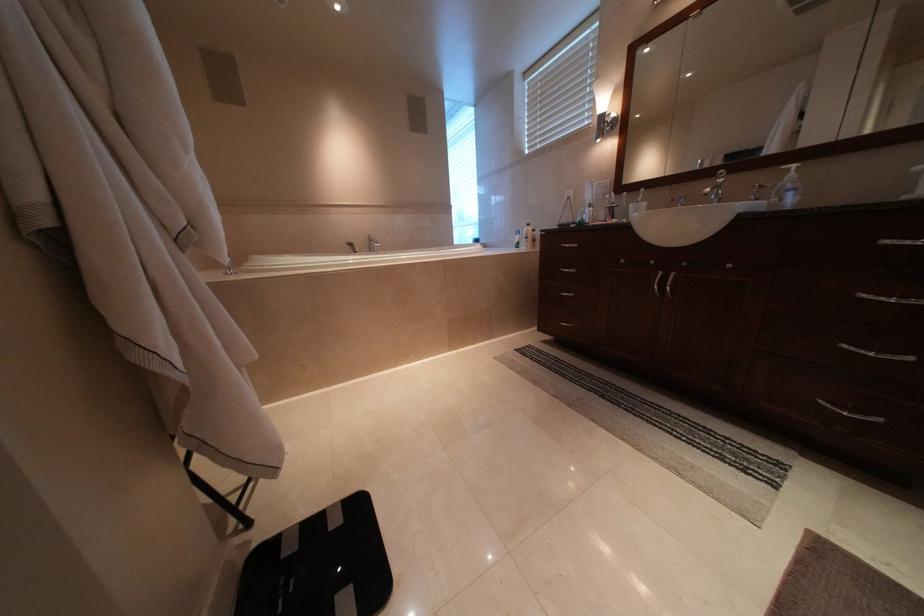
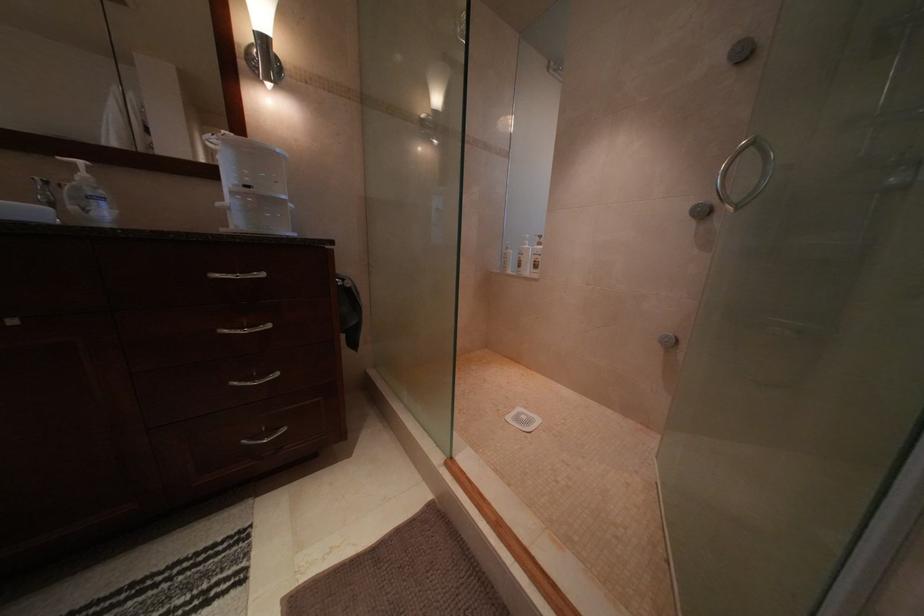
Question: The camera is either moving clockwise (left) or counter-clockwise (right) around the object. The first image is from the beginning of the video and the second image is from the end. Is the camera moving left or right when shooting the video?

Choices:
 (A) Left
 (B) Right

Answer: (A)